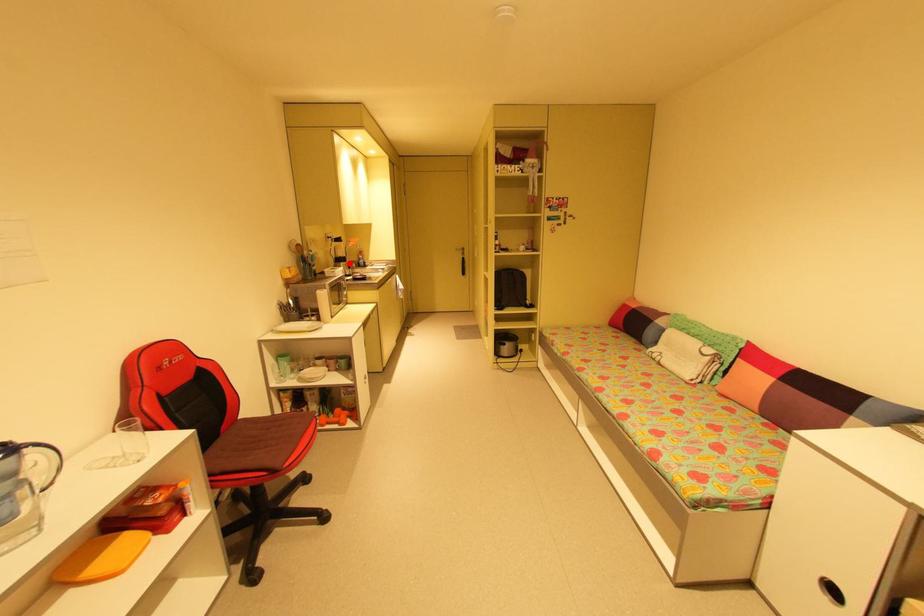
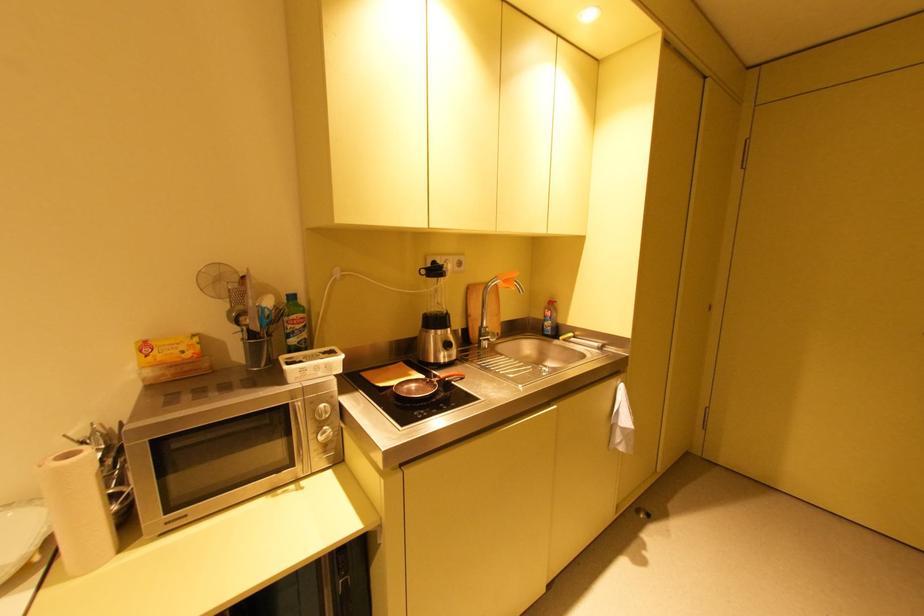
Question: I am providing you with two images of the same scene from different viewpoints. Image1 has a red point marked. In image2, the corresponding 3D location appears at what relative position? Reply with the corresponding letter.

Choices:
 (A) Closer
 (B) Farther

Answer: (B)